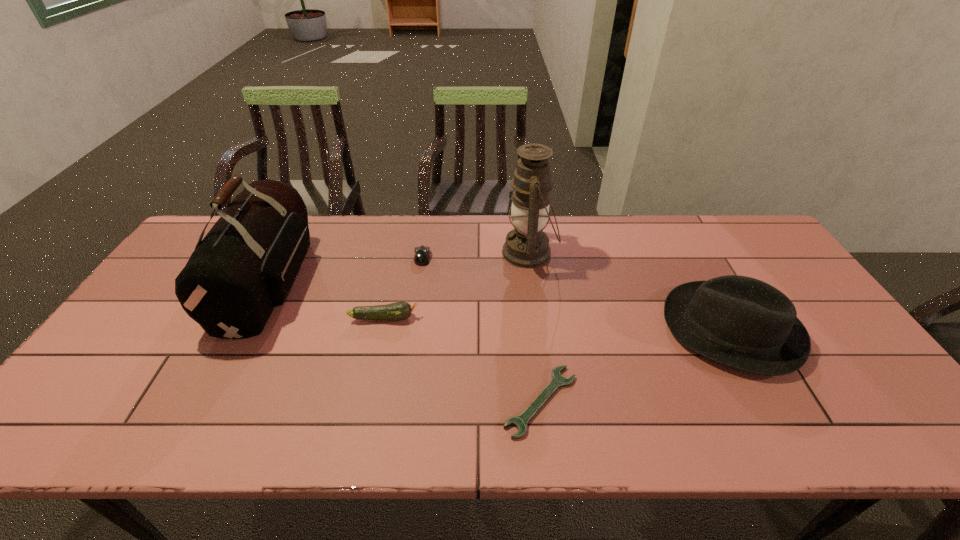
Locate an element on the screen. free space located 0.100m at the blossom end of the zucchini is located at coordinates [455, 318].

Locate an element on the screen. The image size is (960, 540). vacant region located 0.400m on the left of the fifth tallest object is located at coordinates (288, 258).

I want to click on blank space located on the back of the wrench, so click(528, 287).

Locate an element on the screen. Image resolution: width=960 pixels, height=540 pixels. oil lamp present at the far edge is located at coordinates (527, 246).

Identify the location of duffel bag present at the far edge. The height and width of the screenshot is (540, 960). (245, 266).

The width and height of the screenshot is (960, 540). I want to click on mouse positioned at the far edge, so click(x=422, y=254).

Find the location of a particular element. object located in the near edge section of the desktop is located at coordinates (520, 422).

Where is `object that is positioned at the right edge`? object that is positioned at the right edge is located at coordinates (740, 322).

This screenshot has height=540, width=960. In order to click on vacant space at the far edge of the desktop in this screenshot , I will do `click(356, 228)`.

Image resolution: width=960 pixels, height=540 pixels. I want to click on blank space at the near edge of the desktop, so click(x=420, y=435).